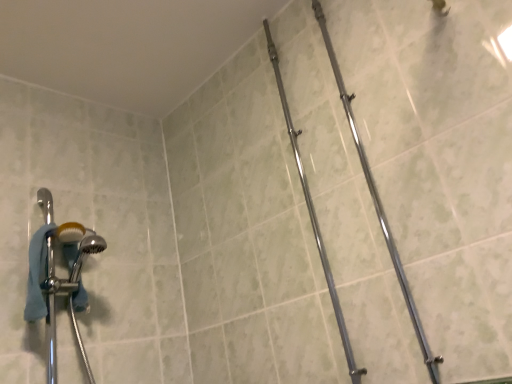
Question: In the image, is chrome/metallic pipe at center-right, placed as the first pipe when sorted from right to left, on the left side or the right side of polished chrome pipe at center, positioned as the second pipe in right-to-left order?

Choices:
 (A) right
 (B) left

Answer: (A)

Question: Based on their sizes in the image, would you say chrome/metallic pipe at center-right, placed as the first pipe when sorted from right to left, is bigger or smaller than polished chrome pipe at center, the 1th pipe in the left-to-right sequence?

Choices:
 (A) big
 (B) small

Answer: (B)

Question: From a real-world perspective, relative to polished chrome pipe at center, the 1th pipe in the left-to-right sequence, is chrome/metallic pipe at center-right, which ranks as the 2th pipe in left-to-right order, vertically above or below?

Choices:
 (A) above
 (B) below

Answer: (B)

Question: Considering the relative positions of polished chrome pipe at center, positioned as the second pipe in right-to-left order, and chrome/metallic pipe at center-right, which ranks as the 2th pipe in left-to-right order, in the image provided, is polished chrome pipe at center, positioned as the second pipe in right-to-left order, to the left or to the right of chrome/metallic pipe at center-right, which ranks as the 2th pipe in left-to-right order,?

Choices:
 (A) left
 (B) right

Answer: (A)

Question: Looking at their shapes, would you say polished chrome pipe at center, positioned as the second pipe in right-to-left order, is wider or thinner than chrome/metallic pipe at center-right, which ranks as the 2th pipe in left-to-right order?

Choices:
 (A) thin
 (B) wide

Answer: (A)

Question: Does point (325, 251) appear closer or farther from the camera than point (361, 153)?

Choices:
 (A) farther
 (B) closer

Answer: (A)

Question: From a real-world perspective, is polished chrome pipe at center, the 1th pipe in the left-to-right sequence, above or below chrome/metallic pipe at center-right, placed as the first pipe when sorted from right to left?

Choices:
 (A) above
 (B) below

Answer: (A)